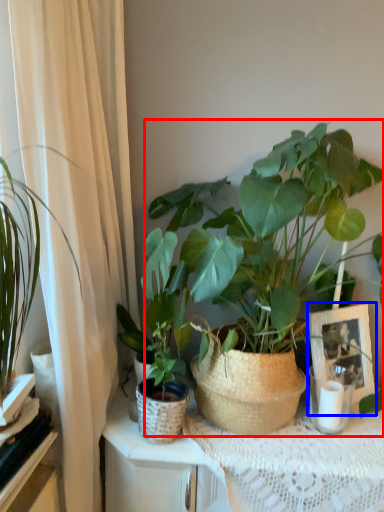
Question: Which object appears closest to the camera in this image, houseplant (highlighted by a red box) or picture frame (highlighted by a blue box)?

Choices:
 (A) houseplant
 (B) picture frame

Answer: (A)